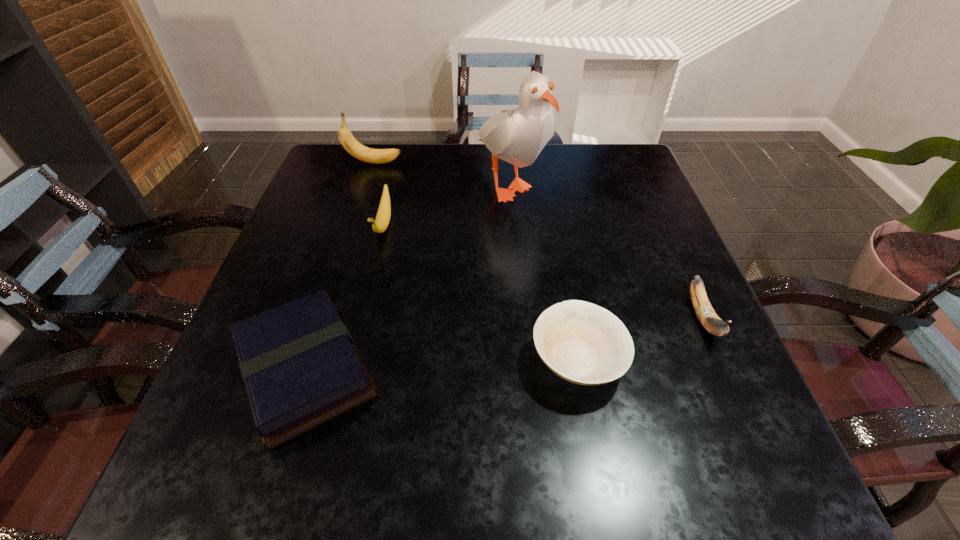
I want to click on blank region between the gull and the second tallest object, so click(x=441, y=173).

Identify the location of vacant area that lies between the gull and the bowl. The image size is (960, 540). (542, 272).

Where is `vacant point located between the second nearest banana and the bowl`? vacant point located between the second nearest banana and the bowl is located at coordinates (481, 293).

This screenshot has width=960, height=540. I want to click on vacant area that lies between the rightmost banana and the second tallest object, so click(539, 240).

The image size is (960, 540). What are the coordinates of `free space between the second farthest banana and the tallest object` in the screenshot? It's located at (445, 204).

Find the location of `free space between the farthest banana and the second farthest banana`. free space between the farthest banana and the second farthest banana is located at coordinates (378, 194).

Where is `free area in between the bowl and the gull`? free area in between the bowl and the gull is located at coordinates (542, 272).

Locate an element on the screen. vacant area between the second farthest banana and the bowl is located at coordinates (481, 293).

Locate an element on the screen. free space between the book and the gull is located at coordinates (406, 276).

Where is `the closest object relative to the book`? the closest object relative to the book is located at coordinates (380, 224).